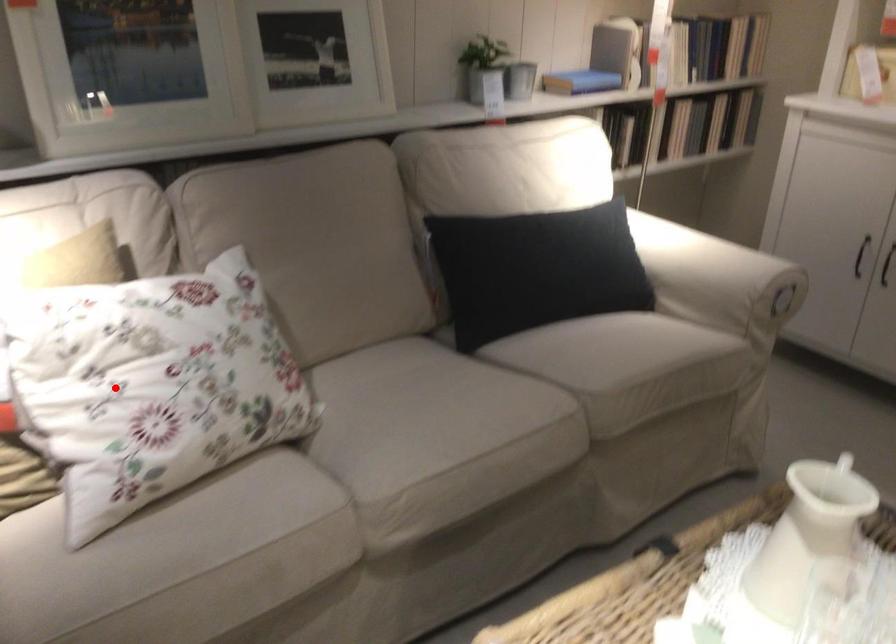
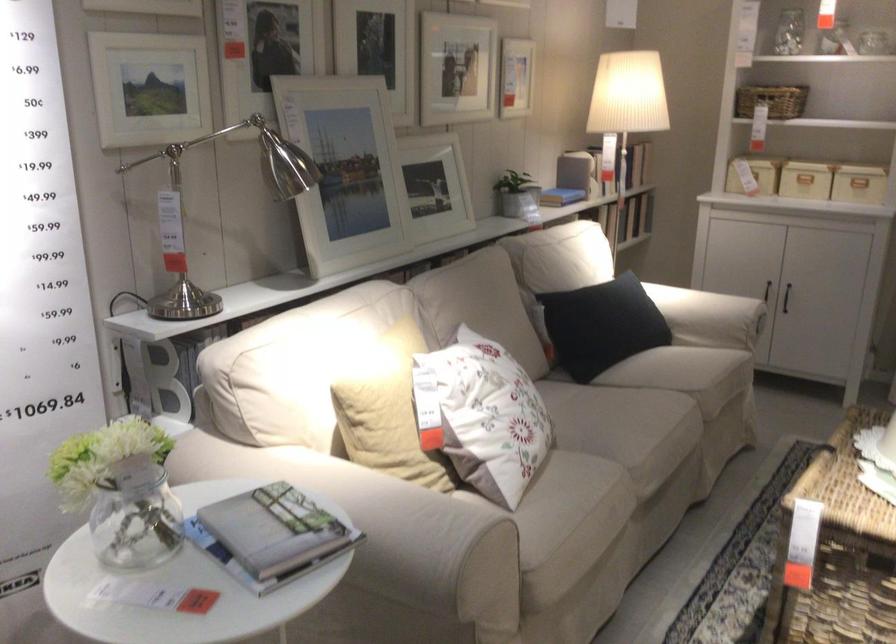
In the second image, find the point that corresponds to the highlighted location in the first image.

(484, 415)